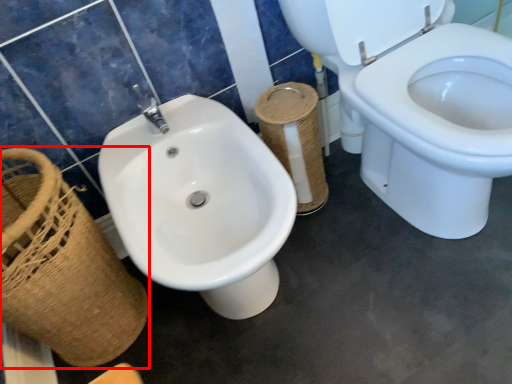
Question: From the image's perspective, where is basket (annotated by the red box) located relative to toilet paper?

Choices:
 (A) below
 (B) above

Answer: (A)